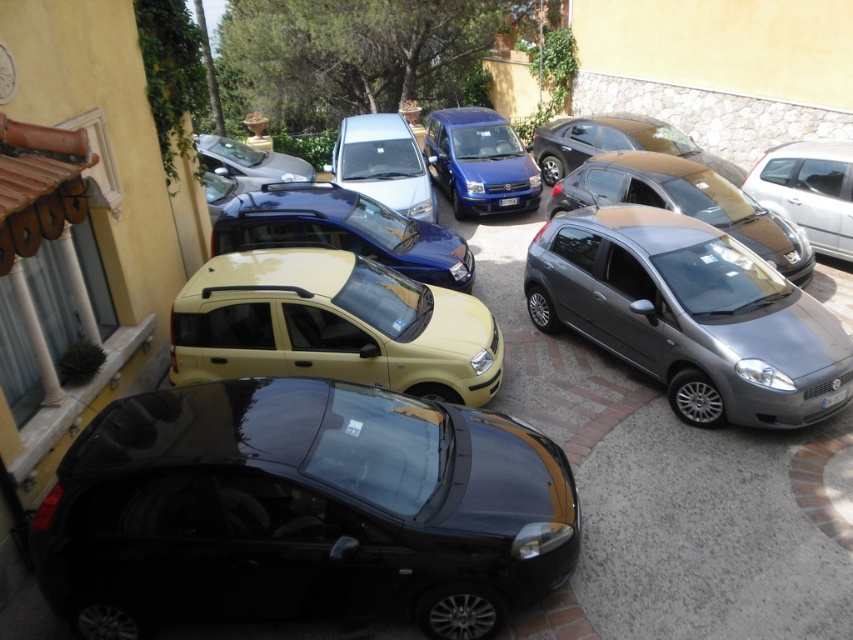
Who is taller, satin silver hatchback at center or white plastic license plate at center?

Standing taller between the two is satin silver hatchback at center.

In the scene shown: Which is more to the left, satin silver hatchback at center or white plastic license plate at center?

white plastic license plate at center is more to the left.

Does point (668, 204) lie behind point (498, 200)?

No, (668, 204) is in front of (498, 200).

What are the coordinates of `satin silver hatchback at center` in the screenshot? It's located at (685, 202).

Between metallic gold sedan at center and metallic silver car at upper center, which one has more height?

Standing taller between the two is metallic gold sedan at center.

Does metallic gold sedan at center lie in front of metallic silver car at upper center?

That is True.

Does point (635, 120) lie behind point (289, 170)?

No, (635, 120) is closer to viewer.

Find the location of `metallic gold sedan at center`. metallic gold sedan at center is located at coordinates (614, 144).

Between point (326, 246) and point (514, 132), which one is positioned behind?

Point (514, 132)

Is point (268, 205) closer to viewer compared to point (439, 182)?

Yes, it is in front of point (439, 182).

Between point (339, 227) and point (517, 209), which one is positioned in front?

Positioned in front is point (339, 227).

Locate an element on the screen. This screenshot has width=853, height=640. glossy blue hatchback at center is located at coordinates (341, 230).